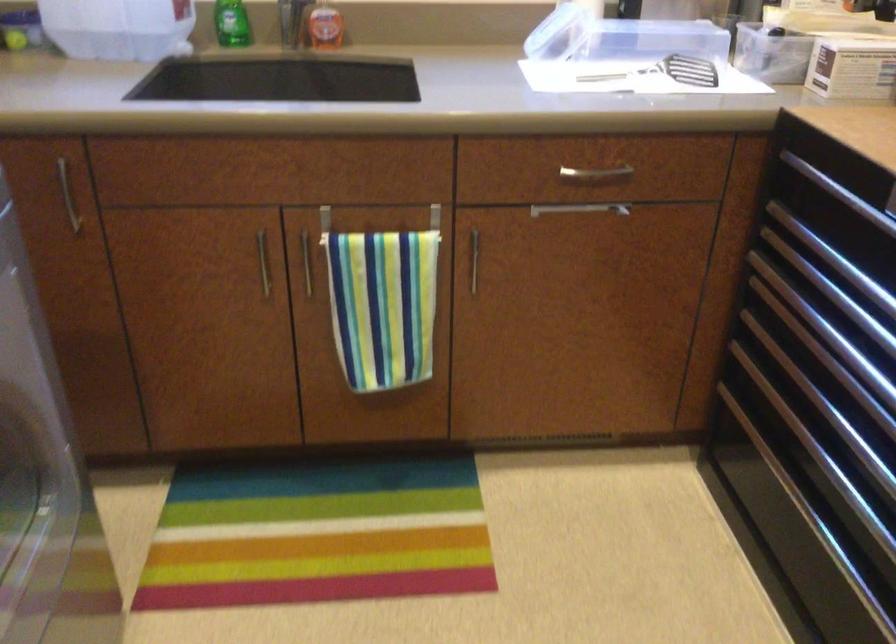
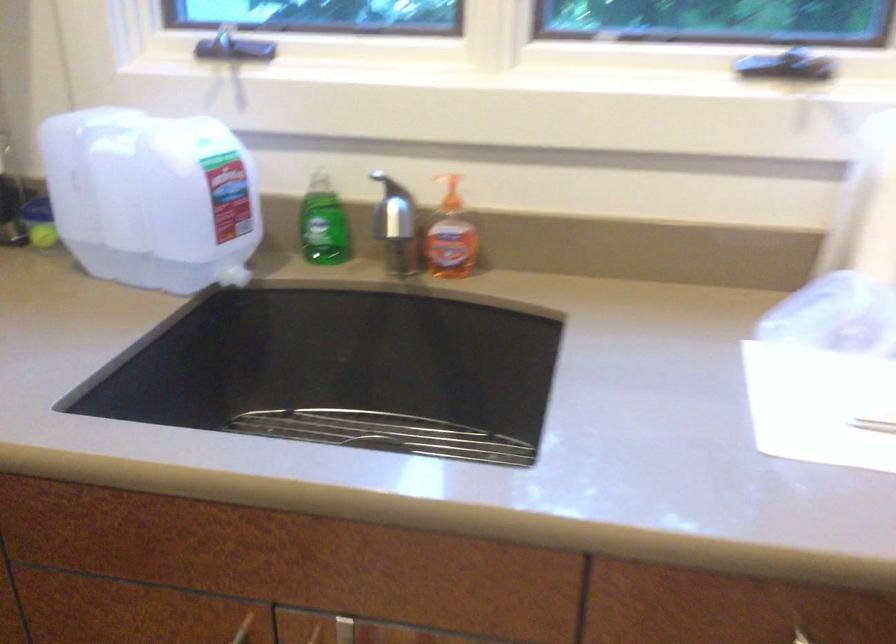
Locate, in the second image, the point that corresponds to [261,234] in the first image.

(243, 629)